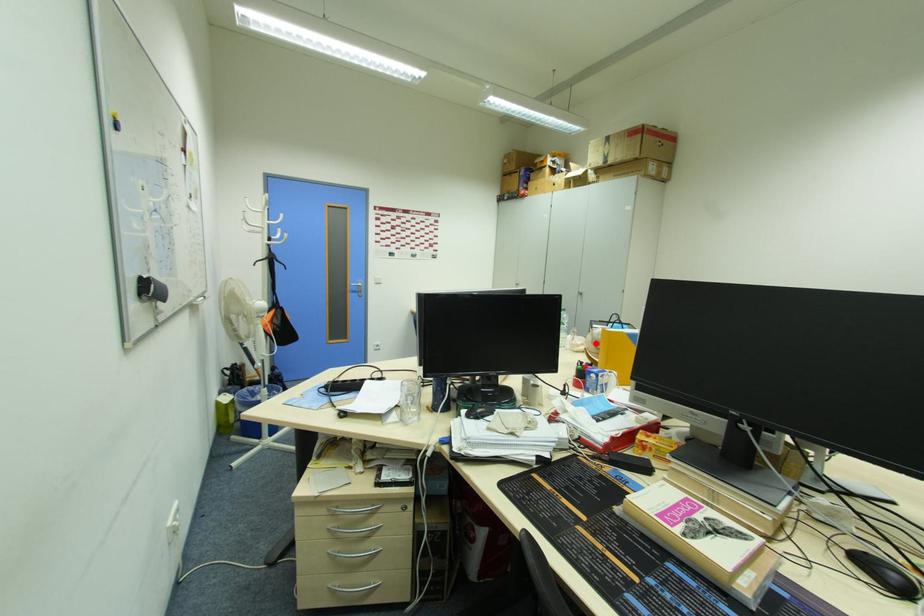
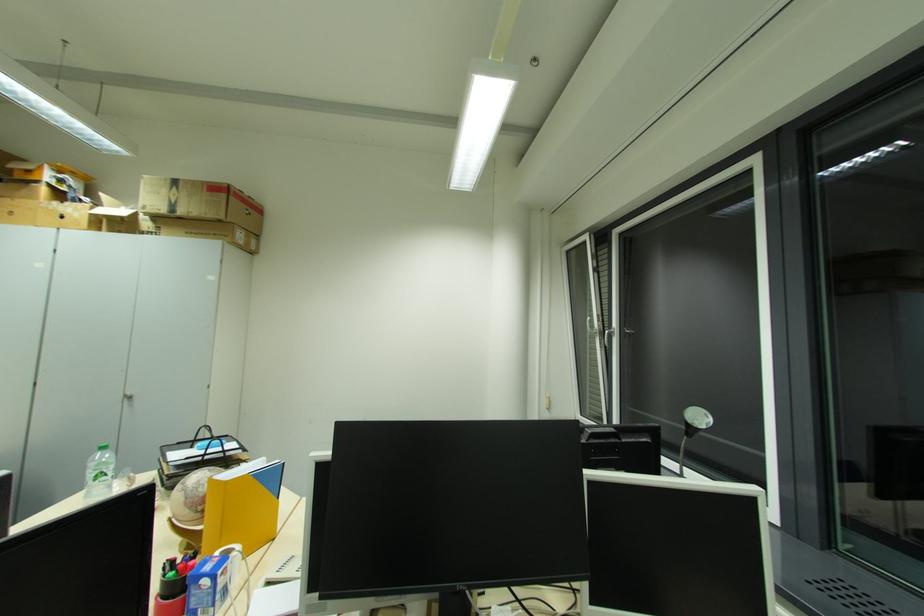
The point at the highlighted location is marked in the first image. Where is the corresponding point in the second image?

(189, 506)